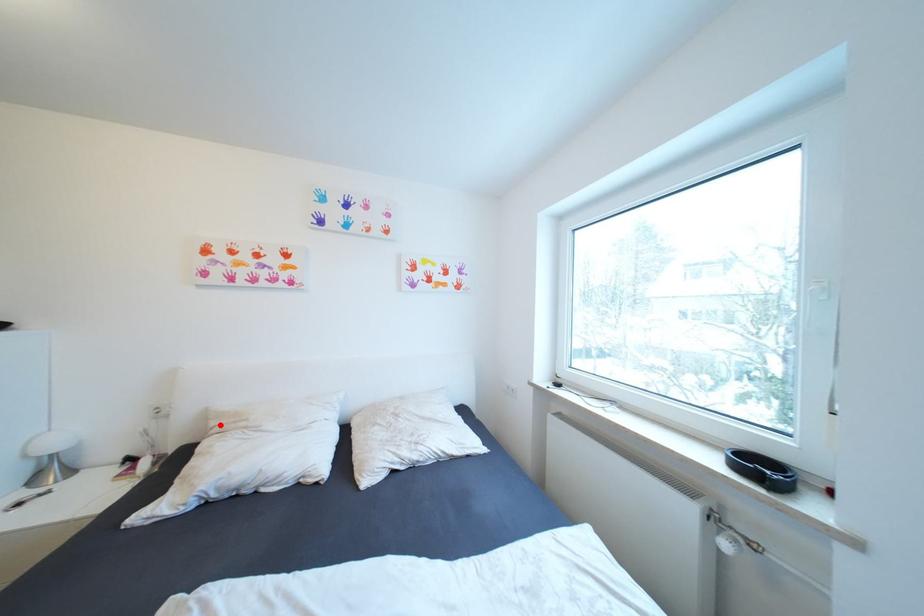
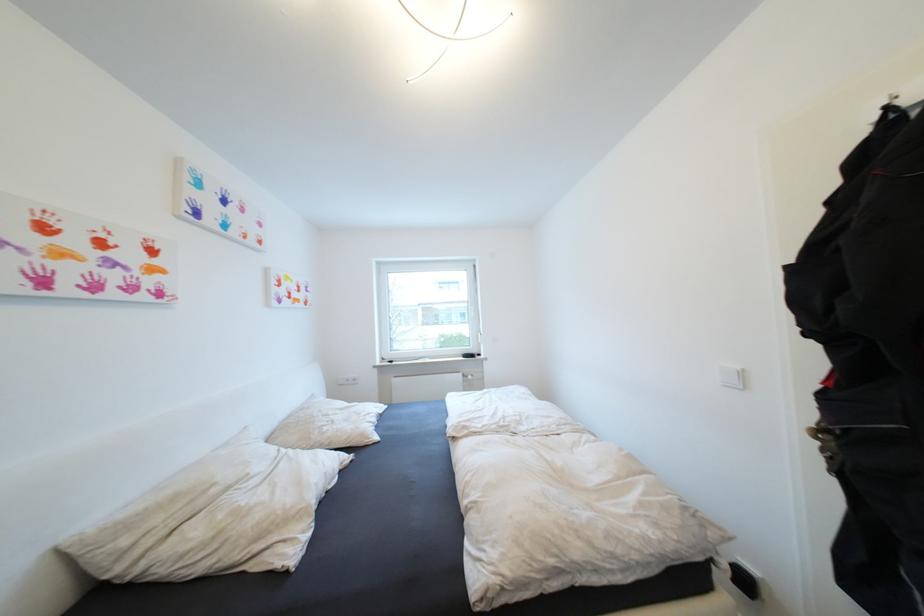
Question: I am providing you with two images of the same scene from different viewpoints. A red point is shown in image1. For the corresponding object point in image2, is it positioned nearer or farther from the camera?

Choices:
 (A) Nearer
 (B) Farther

Answer: (A)